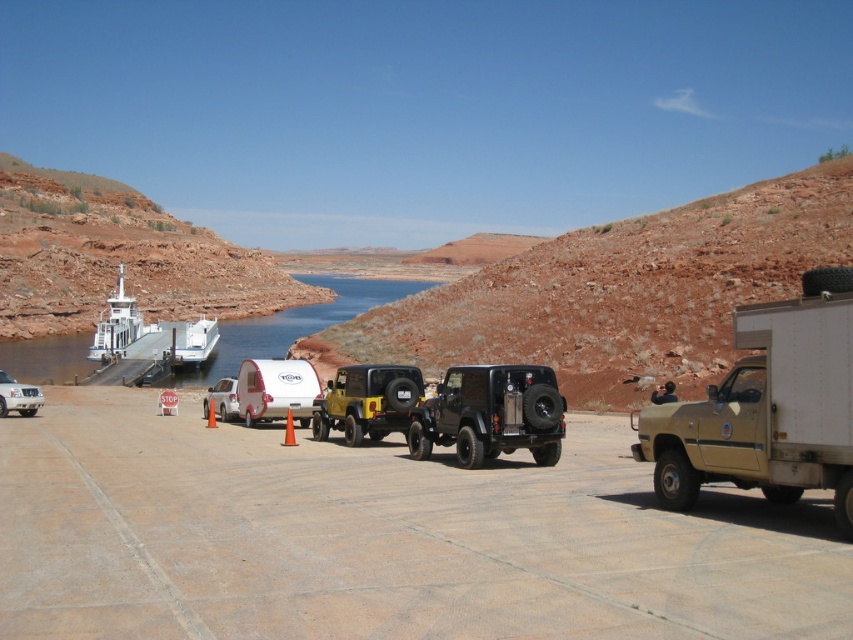
You are planning to take a photo of the white matte camper at center and the white matte boat at left. Which one should you focus on if you want to capture the larger object in your shot?

The white matte boat at left is larger than the white matte camper at center, so you should focus on the white matte boat at left to capture the larger object in your shot.

Looking at this image, you are standing at the ferry dock and want to walk to the point marked as point (792, 362). Which direction should you go relative to the point (0, 404)?

You should walk towards the point (792, 362), which is closer to you than the point (0, 404). Since point (0, 404) is farther away, moving toward the closer point would mean heading in the opposite direction from the distant point.

You are standing at the ferry dock and want to take a photo of the white matte camper at center and the white matte boat at left. Which one should you aim your camera at first if you want to capture both in the same frame without moving your camera?

You should aim your camera at the white matte camper at center first because it is located below the white matte boat at left, so adjusting the camera angle downward will include both in the frame.